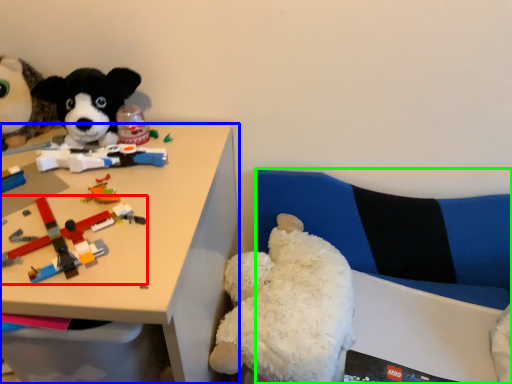
Question: Which object is positioned farthest from toy (highlighted by a red box)? Select from desk (highlighted by a blue box) and couch (highlighted by a green box).

Choices:
 (A) desk
 (B) couch

Answer: (B)